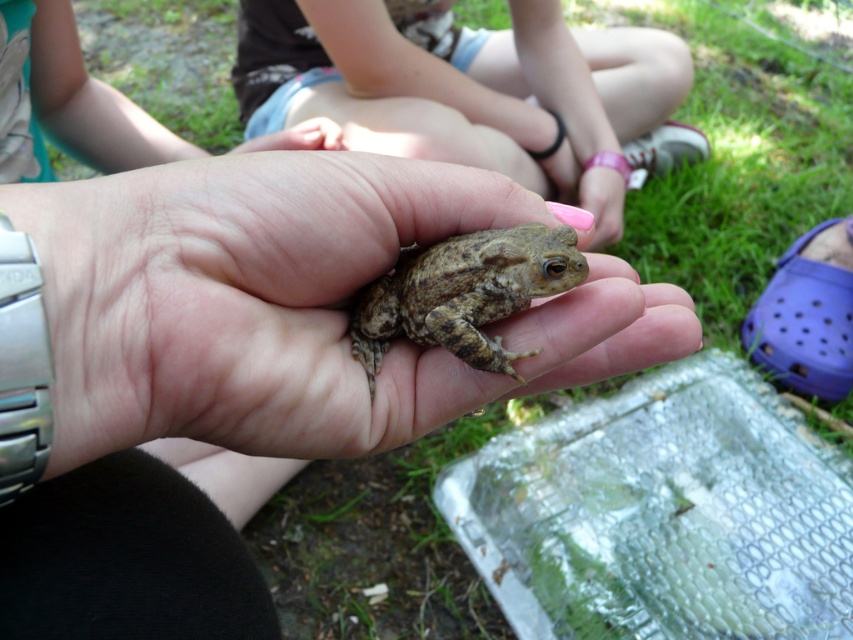
Looking at the image of a person holding frogs, which frog is positioned to the right between the smooth skin frog at center and the brown textured frog at center?

The smooth skin frog at center is positioned to the right of the brown textured frog at center.

You are a wildlife photographer trying to capture a close shot of the frog. Since you see both the smooth skin frog at center and the brown textured frog at center, which one is closer to your camera lens?

The smooth skin frog at center is closer to your camera lens because the brown textured frog at center is positioned behind it.